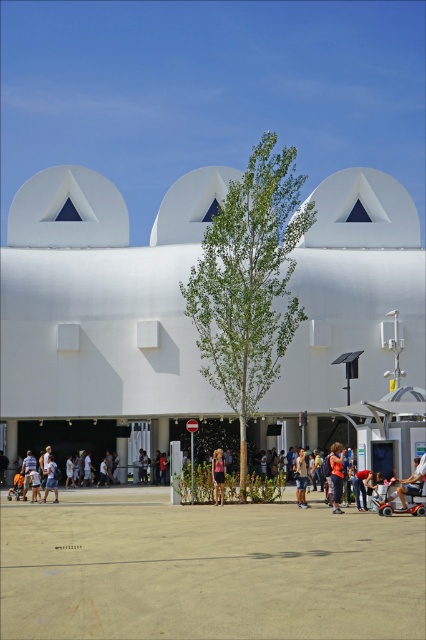
Between orange fabric shirt at center and denim shorts at center, which one appears on the right side from the viewer's perspective?

From the viewer's perspective, orange fabric shirt at center appears more on the right side.

Which of these two, orange fabric shirt at center or denim shorts at center, stands shorter?

denim shorts at center is shorter.

Measure the distance between orange fabric shirt at center and camera.

orange fabric shirt at center and camera are 43.69 meters apart from each other.

Find the location of a particular element. The image size is (426, 640). orange fabric shirt at center is located at coordinates (336, 474).

Is green leafy tree at center in front of orange fabric shirt at center?

No, it is not.

Can you confirm if green leafy tree at center is smaller than orange fabric shirt at center?

No.

Measure the distance between green leafy tree at center and camera.

green leafy tree at center and camera are 51.91 meters apart from each other.

Identify the location of green leafy tree at center. Image resolution: width=426 pixels, height=640 pixels. coord(249,282).

Between point (299, 483) and point (221, 499), which one is positioned in front?

Positioned in front is point (299, 483).

Is denim shorts at center taller than pink fabric dress at center?

Correct, denim shorts at center is much taller as pink fabric dress at center.

Is point (305, 460) in front of point (221, 492)?

No, (305, 460) is further to viewer.

The image size is (426, 640). In order to click on denim shorts at center in this screenshot , I will do `click(301, 480)`.